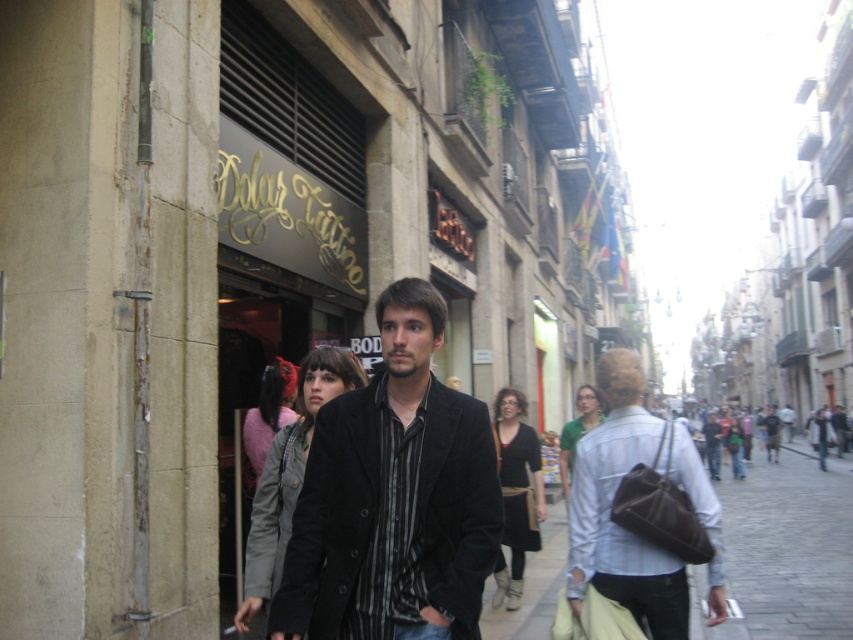
Is point (547, 572) positioned after point (293, 508)?

Yes.

Who is positioned more to the left, brown leather bag at lower right or gray matte jacket at center?

From the viewer's perspective, gray matte jacket at center appears more on the left side.

Is point (780, 621) positioned behind point (273, 468)?

Yes, it is.

I want to click on brown leather bag at lower right, so click(784, 550).

Does black matte coat at center come behind gray matte jacket at center?

That is False.

Describe the element at coordinates (393, 497) in the screenshot. This screenshot has width=853, height=640. I see `black matte coat at center` at that location.

The height and width of the screenshot is (640, 853). Find the location of `black matte coat at center`. black matte coat at center is located at coordinates (393, 497).

Identify the location of black matte coat at center. This screenshot has height=640, width=853. (393, 497).

Does black matte coat at center have a greater width compared to light blue denim shirt at center?

Indeed, black matte coat at center has a greater width compared to light blue denim shirt at center.

Which is more to the left, black matte coat at center or light blue denim shirt at center?

black matte coat at center

Identify the location of black matte coat at center. Image resolution: width=853 pixels, height=640 pixels. (393, 497).

The height and width of the screenshot is (640, 853). I want to click on black matte coat at center, so click(x=393, y=497).